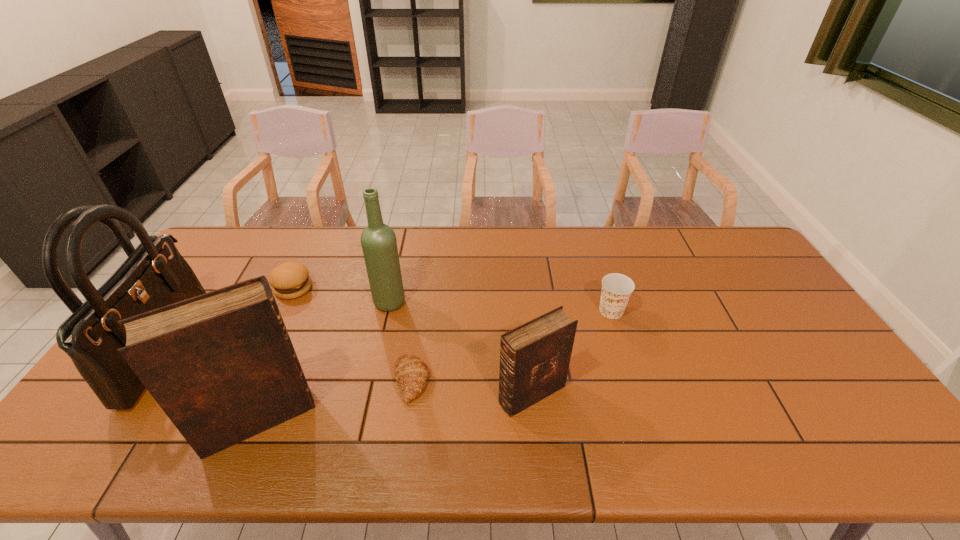
At what (x,y) coordinates should I click in order to perform the action: click on object that is at the near left corner. Please return your answer as a coordinate pair (x, y). This screenshot has height=540, width=960. Looking at the image, I should click on (154, 275).

Identify the location of free space at the far edge of the desktop. (262, 252).

At what (x,y) coordinates should I click in order to perform the action: click on vacant space at the near edge of the desktop. Please return your answer as a coordinate pair (x, y). Image resolution: width=960 pixels, height=540 pixels. Looking at the image, I should click on (555, 411).

The image size is (960, 540). In order to click on vacant space at the far right corner of the desktop in this screenshot , I will do `click(745, 243)`.

At what (x,y) coordinates should I click in order to perform the action: click on free spot between the wine bottle and the hamburger. Please return your answer as a coordinate pair (x, y). This screenshot has height=540, width=960. Looking at the image, I should click on (342, 295).

At what (x,y) coordinates should I click in order to perform the action: click on unoccupied area between the fourth object from right to left and the crescent roll. Please return your answer as a coordinate pair (x, y). This screenshot has height=540, width=960. Looking at the image, I should click on (400, 341).

The height and width of the screenshot is (540, 960). In order to click on free space between the Dixie cup and the wine bottle in this screenshot , I will do `click(500, 306)`.

Identify the location of free spot between the Dixie cup and the left Bible. (435, 365).

Where is `free space between the crescent roll and the second object from right to left`? The image size is (960, 540). free space between the crescent roll and the second object from right to left is located at coordinates coord(471,387).

What are the coordinates of `vacant area between the shorter Bible and the crescent roll` in the screenshot? It's located at (471, 387).